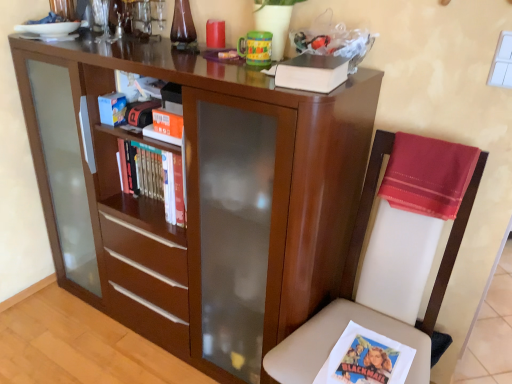
The height and width of the screenshot is (384, 512). Find the location of `hardcover book at upper center`. hardcover book at upper center is located at coordinates (311, 72).

Locate an element on the screen. The image size is (512, 384). hardcover books at center is located at coordinates (153, 177).

Image resolution: width=512 pixels, height=384 pixels. Describe the element at coordinates (199, 197) in the screenshot. I see `matte wood bookcase at center` at that location.

Where is `hardcover book at upper center`? hardcover book at upper center is located at coordinates (311, 72).

Does hardcover book at upper center come in front of matte wood bookcase at center?

No, hardcover book at upper center is further to the viewer.

What are the coordinates of `bookcase lying in front of the hardcover book at upper center` in the screenshot? It's located at (199, 197).

Can you confirm if hardcover book at upper center is positioned to the right of matte wood bookcase at center?

Indeed, hardcover book at upper center is positioned on the right side of matte wood bookcase at center.

Is hardcover book at upper center not close to matte wood bookcase at center?

That's not correct — hardcover book at upper center is a little close to matte wood bookcase at center.

Considering the relative sizes of matte wood bookcase at center and hardcover book at upper center in the image provided, is matte wood bookcase at center shorter than hardcover book at upper center?

No.

Is the depth of matte wood bookcase at center less than that of hardcover book at upper center?

That is True.

From the image's perspective, would you say matte wood bookcase at center is shown under hardcover book at upper center?

Yes, from the image's perspective, matte wood bookcase at center is below hardcover book at upper center.

Can you confirm if hardcover book at upper center is shorter than white leather chair at right?

Yes.

Is hardcover book at upper center positioned beyond the bounds of white leather chair at right?

Absolutely, hardcover book at upper center is external to white leather chair at right.

Is the surface of hardcover book at upper center in direct contact with white leather chair at right?

No, hardcover book at upper center is not in contact with white leather chair at right.

Is hardcover book at upper center bigger or smaller than white leather chair at right?

In the image, hardcover book at upper center appears to be smaller than white leather chair at right.

Can you confirm if hardcover books at center is shorter than matte wood bookcase at center?

Yes.

How different are the orientations of hardcover books at center and matte wood bookcase at center in degrees?

The angle between the facing direction of hardcover books at center and the facing direction of matte wood bookcase at center is 7.75e-05 degrees.

From a real-world perspective, is hardcover books at center physically above matte wood bookcase at center?

Yes, from a real-world perspective, hardcover books at center is over matte wood bookcase at center

Is matte wood bookcase at center bigger than silky red cloth at right?

Yes, matte wood bookcase at center is bigger than silky red cloth at right.

You are a GUI agent. You are given a task and a screenshot of the screen. Output one action in this format:
    pyautogui.click(x=<x>, y=<y>)
    Task: Click on the bookcase that appears below the silky red cloth at right (from the image's perspective)
    This screenshot has height=384, width=512.
    Given the screenshot: What is the action you would take?
    pyautogui.click(x=199, y=197)

Looking at this image, is matte wood bookcase at center shorter than silky red cloth at right?

In fact, matte wood bookcase at center may be taller than silky red cloth at right.

Is matte wood bookcase at center oriented away from silky red cloth at right?

matte wood bookcase at center does not have its back to silky red cloth at right.

Looking at this image, from the image's perspective, is silky red cloth at right positioned above or below hardcover book at upper center?

Based on their image positions, silky red cloth at right is located beneath hardcover book at upper center.

Who is shorter, silky red cloth at right or hardcover book at upper center?

Standing shorter between the two is hardcover book at upper center.

From a real-world perspective, is silky red cloth at right located higher than hardcover book at upper center?

No, from a real-world perspective, silky red cloth at right is not above hardcover book at upper center.

Is the position of silky red cloth at right less distant than that of hardcover book at upper center?

No.

This screenshot has height=384, width=512. What are the coordinates of `book above the silky red cloth at right (from the image's perspective)` in the screenshot? It's located at (153, 177).

Is hardcover books at center not near silky red cloth at right?

That's not correct — hardcover books at center is a little close to silky red cloth at right.

From a real-world perspective, which object stands above the other?

silky red cloth at right, from a real-world perspective.

Looking at their sizes, would you say hardcover books at center is wider or thinner than silky red cloth at right?

Clearly, hardcover books at center has more width compared to silky red cloth at right.

At what (x,y) coordinates should I click in order to perform the action: click on paperback book above the matte wood bookcase at center (from the image's perspective). Please return your answer as a coordinate pair (x, y). The width and height of the screenshot is (512, 384). Looking at the image, I should click on (311, 72).

Locate an element on the screen. Image resolution: width=512 pixels, height=384 pixels. paperback book lying on the right of matte wood bookcase at center is located at coordinates (311, 72).

Looking at this image, based on their spatial positions, is white leather chair at right or hardcover book at upper center closer to hardcover books at center?

hardcover book at upper center.

Looking at the image, which one is located closer to hardcover book at upper center, hardcover books at center or white leather chair at right?

white leather chair at right.

Estimate the real-world distances between objects in this image. Which object is closer to hardcover books at center, hardcover book at upper center or silky red cloth at right?

hardcover book at upper center is positioned closer to the anchor hardcover books at center.

Looking at the image, which one is located further to silky red cloth at right, hardcover books at center or matte wood bookcase at center?

Based on the image, hardcover books at center appears to be further to silky red cloth at right.

Looking at the image, which one is located further to matte wood bookcase at center, hardcover books at center or white leather chair at right?

white leather chair at right lies further to matte wood bookcase at center than the other object.

Estimate the real-world distances between objects in this image. Which object is closer to matte wood bookcase at center, silky red cloth at right or hardcover book at upper center?

silky red cloth at right is positioned closer to the anchor matte wood bookcase at center.

Based on their spatial positions, is hardcover book at upper center or hardcover books at center closer to white leather chair at right?

hardcover book at upper center lies closer to white leather chair at right than the other object.

From the image, which object appears to be farther from hardcover books at center, silky red cloth at right or matte wood bookcase at center?

Based on the image, silky red cloth at right appears to be further to hardcover books at center.

The width and height of the screenshot is (512, 384). I want to click on chair between hardcover books at center and silky red cloth at right in the horizontal direction, so click(x=362, y=305).

You are a GUI agent. You are given a task and a screenshot of the screen. Output one action in this format:
    pyautogui.click(x=<x>, y=<y>)
    Task: Click on the paperback book positioned between white leather chair at right and hardcover books at center from near to far
    Image resolution: width=512 pixels, height=384 pixels.
    Given the screenshot: What is the action you would take?
    pyautogui.click(x=311, y=72)

Identify the location of bookcase between hardcover books at center and white leather chair at right in the horizontal direction. (199, 197).

Locate an element on the screen. paperback book between matte wood bookcase at center and hardcover books at center from front to back is located at coordinates (311, 72).